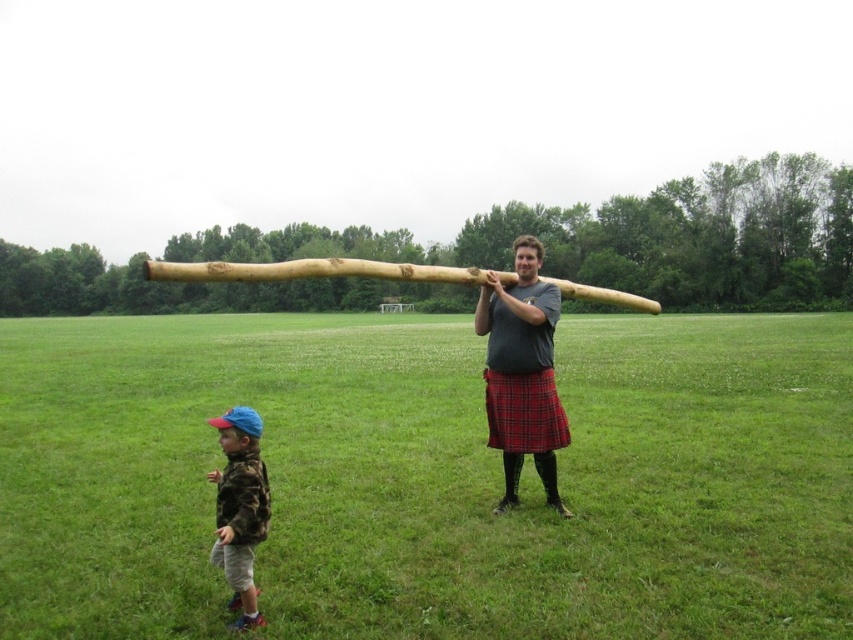
Question: From the image, what is the correct spatial relationship of green grass at center in relation to red plaid kilt at center?

Choices:
 (A) above
 (B) below

Answer: (B)

Question: Which point is closer to the camera taking this photo?

Choices:
 (A) (599, 369)
 (B) (250, 612)
 (C) (502, 417)

Answer: (B)

Question: Is green grass at center further to camera compared to red plaid kilt at center?

Choices:
 (A) no
 (B) yes

Answer: (A)

Question: Based on their relative distances, which object is nearer to the camo fabric shirt at lower left?

Choices:
 (A) green grass at center
 (B) red plaid kilt at center

Answer: (B)

Question: Among these points, which one is farthest from the camera?

Choices:
 (A) (422, 328)
 (B) (250, 525)

Answer: (A)

Question: Where is matte wooden pole at center located in relation to red plaid kilt at center in the image?

Choices:
 (A) right
 (B) left

Answer: (B)